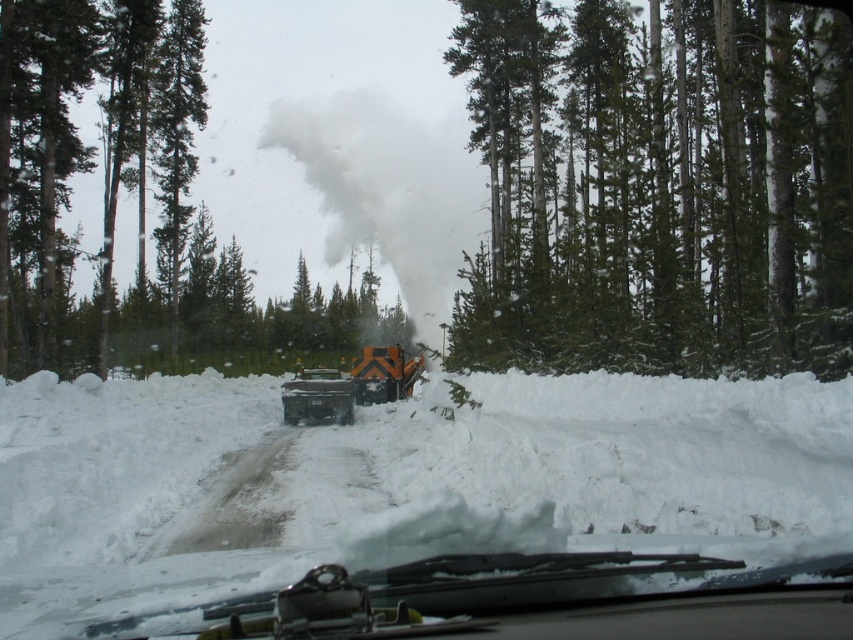
You are driving a car with a length of 15 feet. You need to pass through the narrow road in the image. The green textured tree at upper left is blocking your path. Can you safely navigate around it without hitting the tree?

The green textured tree at upper left is 65.96 feet away from the viewer. Since the distance is much greater than the car length of 15 feet, you can safely navigate around the tree without hitting it.

You are driving a car and want to pass the orange metallic trailer truck at center. You notice a green textured tree at upper left in your rearview mirror. Which object will disappear from your view first as you move forward?

The orange metallic trailer truck at center will disappear from your view first because it is closer to you than the green textured tree at upper left, which is farther away.